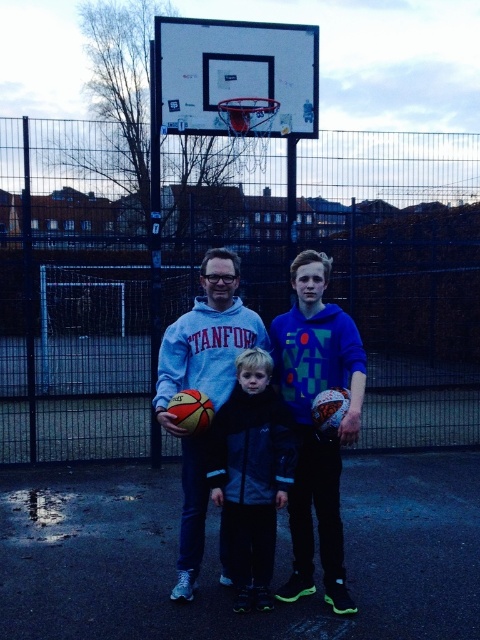
Can you confirm if blue fleece hoodie at center is positioned below black matte jacket at center?

No.

Is blue fleece hoodie at center further to camera compared to black matte jacket at center?

That is False.

Between point (310, 529) and point (252, 548), which one is positioned in front?

Point (252, 548)

Find the location of a particular element. The height and width of the screenshot is (640, 480). blue fleece hoodie at center is located at coordinates (312, 424).

Is blue fleece hoodie at center shorter than matte blue hoodie at center?

Correct, blue fleece hoodie at center is not as tall as matte blue hoodie at center.

Which of these two, blue fleece hoodie at center or matte blue hoodie at center, stands taller?

Standing taller between the two is matte blue hoodie at center.

You are a GUI agent. You are given a task and a screenshot of the screen. Output one action in this format:
    pyautogui.click(x=<x>, y=<y>)
    Task: Click on the blue fleece hoodie at center
    The image size is (480, 640).
    Given the screenshot: What is the action you would take?
    pyautogui.click(x=312, y=424)

Locate an element on the screen. This screenshot has height=640, width=480. blue fleece hoodie at center is located at coordinates (312, 424).

What do you see at coordinates (252, 476) in the screenshot? The height and width of the screenshot is (640, 480). I see `black matte jacket at center` at bounding box center [252, 476].

Is the position of black matte jacket at center more distant than that of matte blue hoodie at center?

No, it is not.

Does point (287, 480) lie in front of point (219, 577)?

Yes, it is.

Identify the location of black matte jacket at center. Image resolution: width=480 pixels, height=640 pixels. (252, 476).